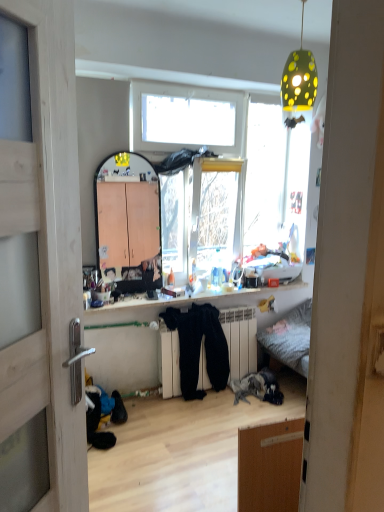
Question: Considering the relative sizes of white matte radiator at center and shiny plastic shelf at center in the image provided, is white matte radiator at center shorter than shiny plastic shelf at center?

Choices:
 (A) yes
 (B) no

Answer: (B)

Question: Would you consider white matte radiator at center to be distant from shiny plastic shelf at center?

Choices:
 (A) yes
 (B) no

Answer: (B)

Question: From the image's perspective, does white matte radiator at center appear higher than shiny plastic shelf at center?

Choices:
 (A) no
 (B) yes

Answer: (A)

Question: Is white matte radiator at center further to camera compared to shiny plastic shelf at center?

Choices:
 (A) no
 (B) yes

Answer: (B)

Question: Does white matte radiator at center have a smaller size compared to shiny plastic shelf at center?

Choices:
 (A) yes
 (B) no

Answer: (B)

Question: From a real-world perspective, relative to green dotted lampshade at upper center, is wooden door at left vertically above or below?

Choices:
 (A) above
 (B) below

Answer: (B)

Question: From the image's perspective, relative to green dotted lampshade at upper center, is wooden door at left above or below?

Choices:
 (A) above
 (B) below

Answer: (B)

Question: Based on their sizes in the image, would you say wooden door at left is bigger or smaller than green dotted lampshade at upper center?

Choices:
 (A) small
 (B) big

Answer: (B)

Question: Considering the relative positions of wooden door at left and green dotted lampshade at upper center in the image provided, is wooden door at left to the left or to the right of green dotted lampshade at upper center?

Choices:
 (A) left
 (B) right

Answer: (A)

Question: Is wooden door at left in front of or behind shiny plastic shelf at center in the image?

Choices:
 (A) behind
 (B) front

Answer: (B)

Question: From the image's perspective, is wooden door at left positioned above or below shiny plastic shelf at center?

Choices:
 (A) above
 (B) below

Answer: (A)

Question: Is point (18, 262) closer or farther from the camera than point (291, 286)?

Choices:
 (A) farther
 (B) closer

Answer: (B)

Question: From a real-world perspective, relative to shiny plastic shelf at center, is wooden door at left vertically above or below?

Choices:
 (A) above
 (B) below

Answer: (A)

Question: Considering their positions, is white matte radiator at center located in front of or behind shiny plastic shelf at center?

Choices:
 (A) behind
 (B) front

Answer: (A)

Question: From the image's perspective, is white matte radiator at center positioned above or below shiny plastic shelf at center?

Choices:
 (A) above
 (B) below

Answer: (B)